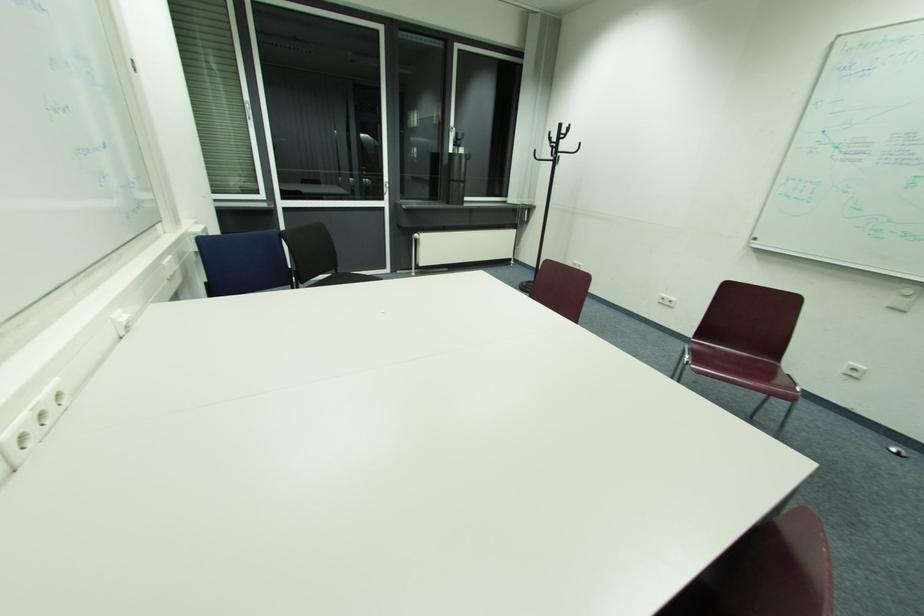
Identify the location of white window handle. (387, 190).